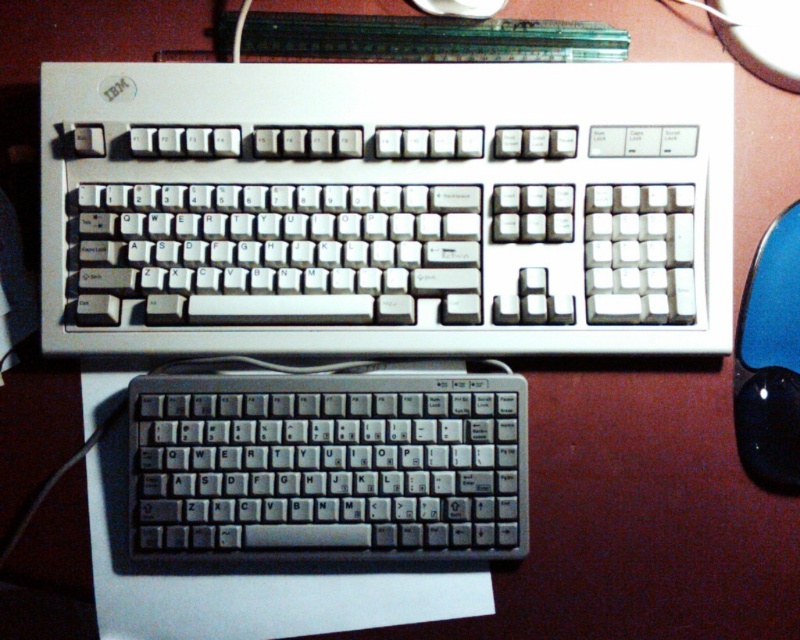
Question: Which object is closer to the camera taking this photo?

Choices:
 (A) white plastic keyboard at center
 (B) silver metallic keyboard at lower center

Answer: (B)

Question: Among these objects, which one is nearest to the camera?

Choices:
 (A) white plastic keyboard at center
 (B) silver metallic keyboard at lower center
 (C) black glossy mouse at right

Answer: (B)

Question: Considering the relative positions of white plastic keyboard at center and black glossy mouse at right in the image provided, where is white plastic keyboard at center located with respect to black glossy mouse at right?

Choices:
 (A) above
 (B) below

Answer: (A)

Question: Is white plastic keyboard at center above silver metallic keyboard at lower center?

Choices:
 (A) yes
 (B) no

Answer: (A)

Question: Is white plastic keyboard at center thinner than black glossy mouse at right?

Choices:
 (A) yes
 (B) no

Answer: (B)

Question: Which of these objects is positioned farthest from the white plastic keyboard at center?

Choices:
 (A) black glossy mouse at right
 (B) silver metallic keyboard at lower center

Answer: (A)